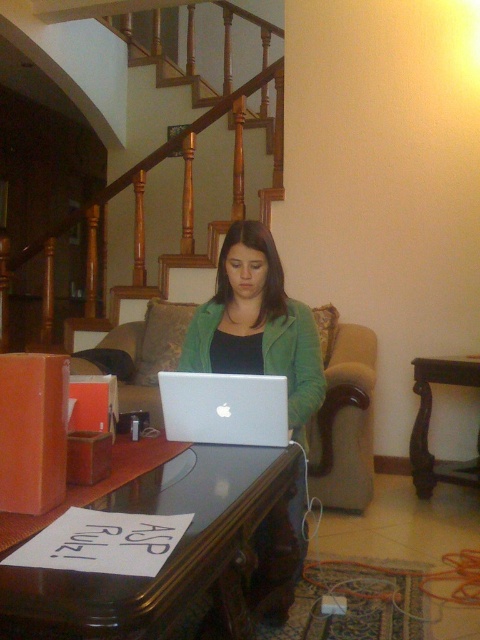
Question: Considering the relative positions of silver metallic laptop at center and brown wood table at lower right in the image provided, where is silver metallic laptop at center located with respect to brown wood table at lower right?

Choices:
 (A) below
 (B) above

Answer: (B)

Question: Among these points, which one is nearest to the camera?

Choices:
 (A) (312, 332)
 (B) (344, 436)
 (C) (265, 522)
 (D) (152, 228)

Answer: (C)

Question: Can you confirm if matte green jacket at center is positioned to the left of silver metallic laptop at center?

Choices:
 (A) yes
 (B) no

Answer: (B)

Question: Which point is farther to the camera?

Choices:
 (A) (444, 465)
 (B) (228, 440)
 (C) (20, 611)

Answer: (A)

Question: In this image, where is beige fabric couch at center located relative to brown wood table at lower right?

Choices:
 (A) below
 (B) above

Answer: (B)

Question: Based on their relative distances, which object is nearer to the silver metallic laptop at center?

Choices:
 (A) brown wood table at lower right
 (B) black glossy table at lower center

Answer: (B)